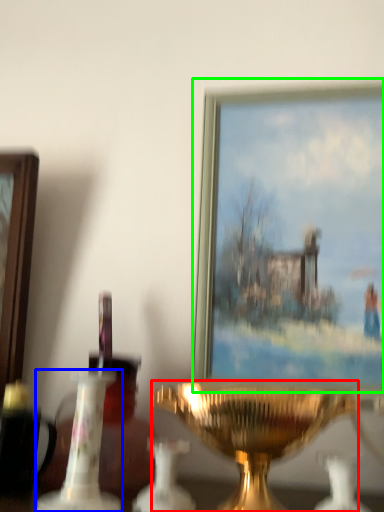
Question: Estimate the real-world distances between objects in this image. Which object is closer to candle holder (highlighted by a red box), candle holder (highlighted by a blue box) or picture frame (highlighted by a green box)?

Choices:
 (A) candle holder
 (B) picture frame

Answer: (A)